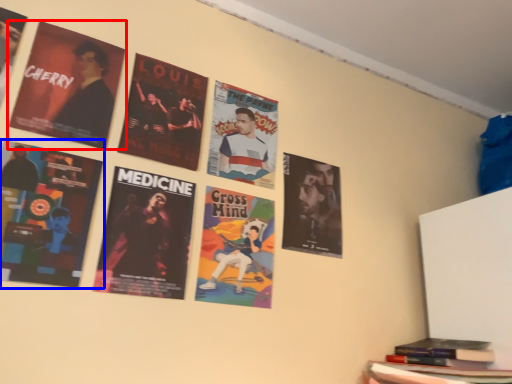
Question: Which object is further to the camera taking this photo, poster (highlighted by a red box) or poster (highlighted by a blue box)?

Choices:
 (A) poster
 (B) poster

Answer: (A)